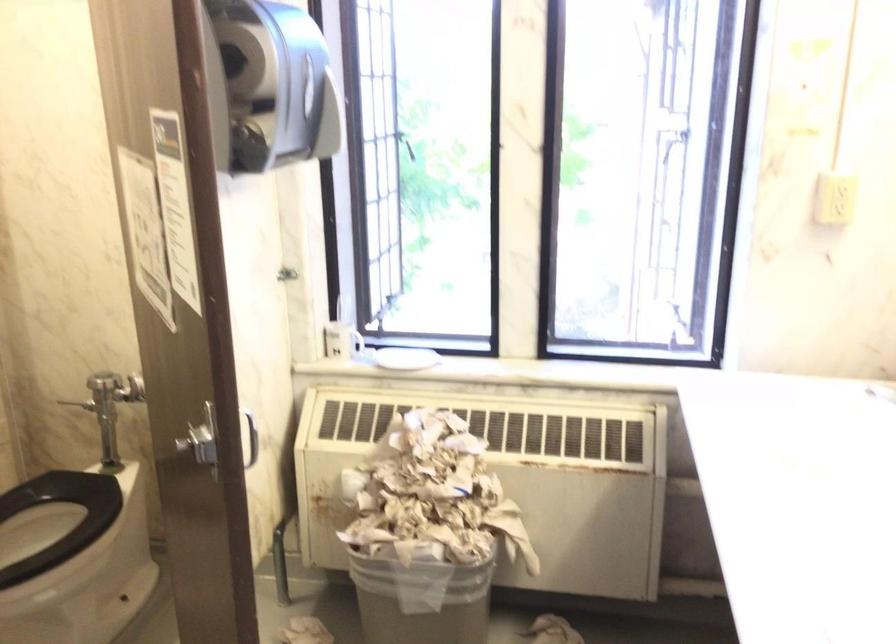
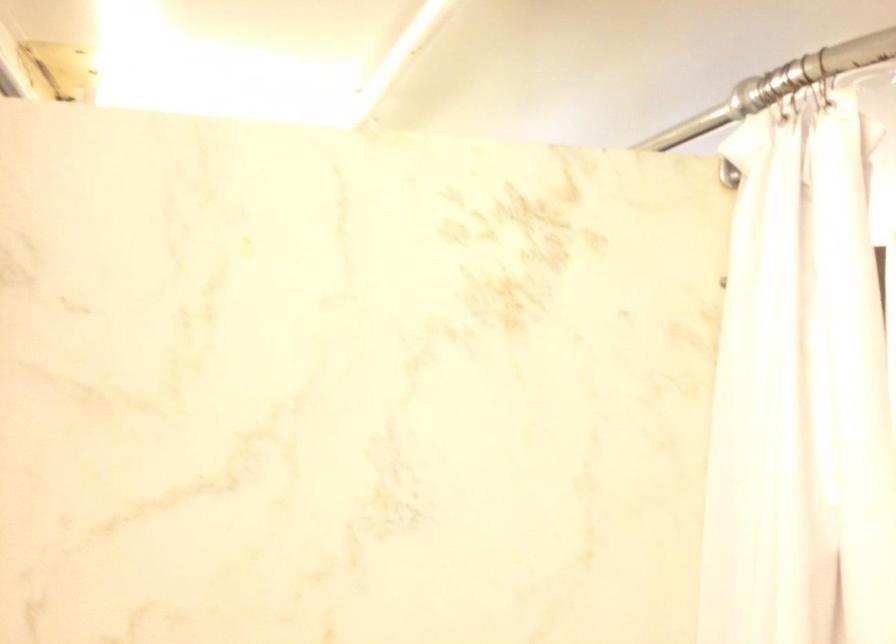
Question: What movement of the cameraman would produce the second image?

Choices:
 (A) Left
 (B) Right
 (C) Forward
 (D) Backward

Answer: (A)